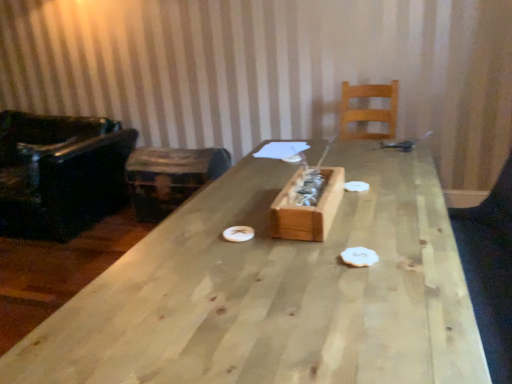
Locate an element on the screen. Image resolution: width=512 pixels, height=384 pixels. spots to the right of wooden box at center is located at coordinates (386, 209).